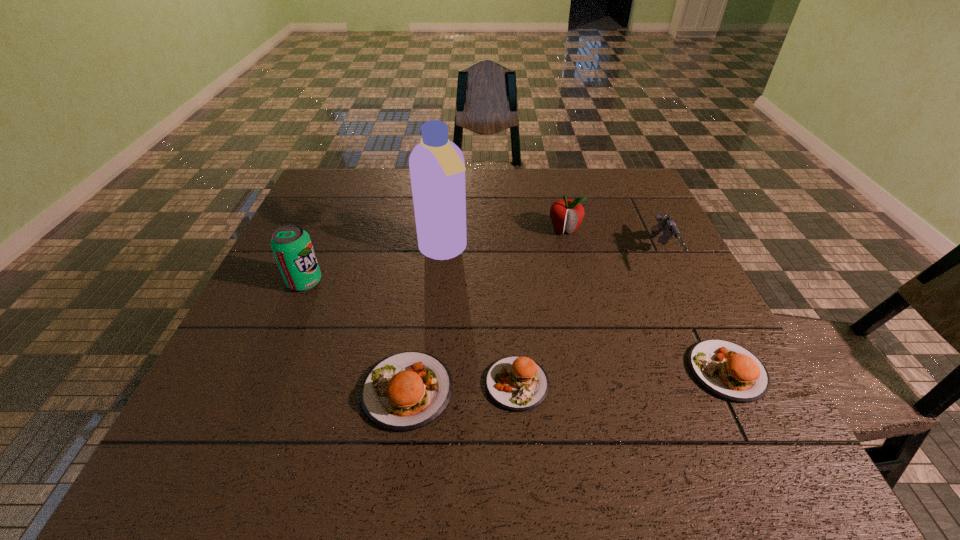
Locate an element on the screen. vacant point located between the shampoo and the gun is located at coordinates (553, 253).

You are a GUI agent. You are given a task and a screenshot of the screen. Output one action in this format:
    pyautogui.click(x=<x>, y=<y>)
    Task: Click on the empty location between the third object from right to left and the leftmost patty
    The width and height of the screenshot is (960, 540).
    Given the screenshot: What is the action you would take?
    pyautogui.click(x=486, y=310)

Identify the location of free spot between the apple and the second shortest object. (645, 300).

Identify the location of vacant point located between the rightmost patty and the gun. The height and width of the screenshot is (540, 960). (695, 313).

Locate which object ranks in proximity to the leftmost patty. Please provide its 2D coordinates. Your answer should be formatted as a tuple, i.e. [(x, y)], where the tuple contains the x and y coordinates of a point satisfying the conditions above.

[(516, 383)]

Select which object is the third closest to the fourth object from right to left. Please provide its 2D coordinates. Your answer should be formatted as a tuple, i.e. [(x, y)], where the tuple contains the x and y coordinates of a point satisfying the conditions above.

[(728, 370)]

Identify which patty is located as the nearest to the leftmost patty. Please provide its 2D coordinates. Your answer should be formatted as a tuple, i.e. [(x, y)], where the tuple contains the x and y coordinates of a point satisfying the conditions above.

[(516, 383)]

Where is `patty that is the second nearest to the apple`? patty that is the second nearest to the apple is located at coordinates [516, 383].

Find the location of a particular element. vacant space that satisfies the following two spatial constraints: 1. on the front side of the third object from right to left; 2. on the front-facing side of the pop soda is located at coordinates (577, 282).

This screenshot has width=960, height=540. Identify the location of vacant space that satisfies the following two spatial constraints: 1. on the front-facing side of the shortest patty; 2. on the left side of the sixth shortest object. (260, 383).